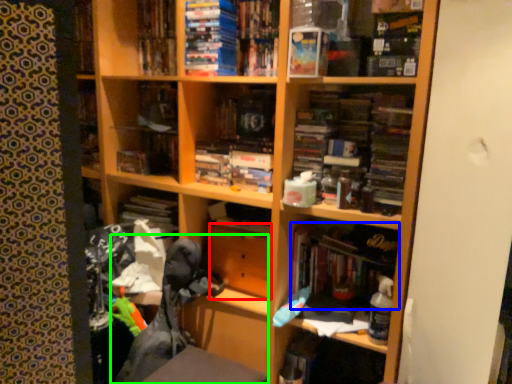
Question: Which object is the farthest from drawer (highlighted by a red box)? Choose among these: book (highlighted by a blue box) or swivel chair (highlighted by a green box).

Choices:
 (A) book
 (B) swivel chair

Answer: (A)